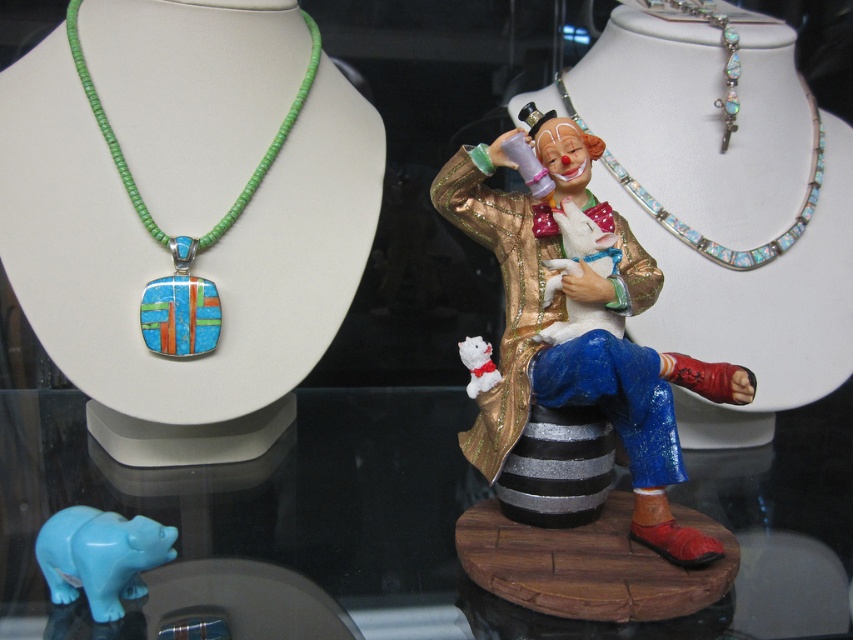
You are setting up a shelf and need to place the turquoise glossy bear at lower left and the white plush toy at center. If the shelf has a width of 30 cm, can both items fit side by side without overlapping?

The turquoise glossy bear at lower left might be wider than the white plush toy at center, so it is uncertain if both can fit within 30 cm without overlapping. Measure their combined width to confirm.

You are an artist planning to sketch the display setup. You need to position the multicolored inlay pendant at left and the silver necklace with rectangular stones at right accurately. According to the coordinates provided, which object is positioned lower on the image?

The multicolored inlay pendant at left is located at point (184, 236), which has a lower y coordinate than the silver necklace with rectangular stones at right, so it is positioned lower in the image.

You are standing in front of the display setup. The multicolored inlay pendant at left is part of a necklace on the left mannequin bust. If you want to reach it without moving the display, can you estimate how far it is from you?

The multicolored inlay pendant at left is 94.67 centimeters away from the viewer, so you can estimate that it is approximately 95 centimeters away.